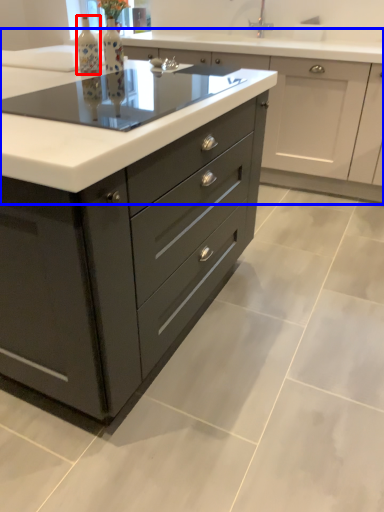
Question: Which object is closer to the camera taking this photo, bottle (highlighted by a red box) or cabinetry (highlighted by a blue box)?

Choices:
 (A) bottle
 (B) cabinetry

Answer: (A)